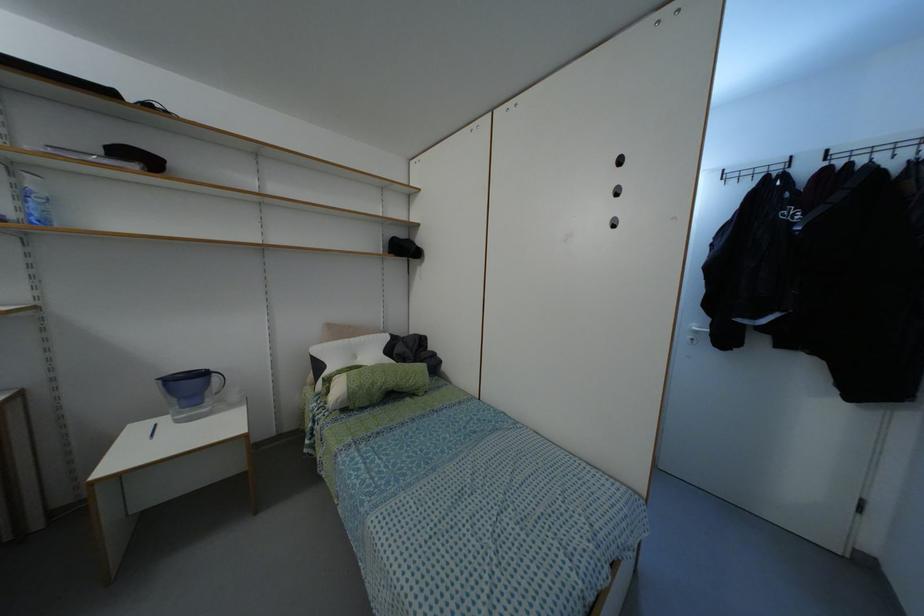
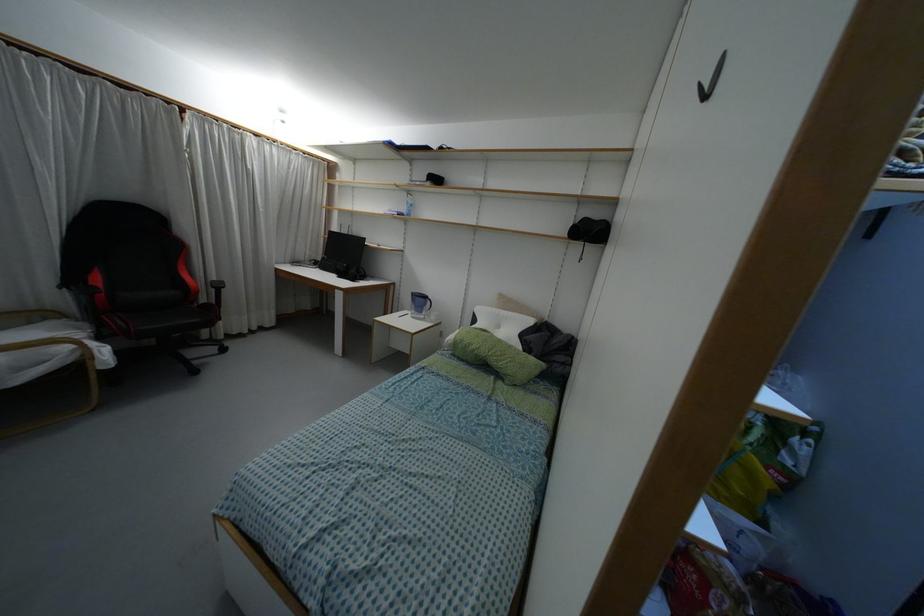
Locate, in the second image, the point that corresponds to (214,378) in the first image.

(428, 302)